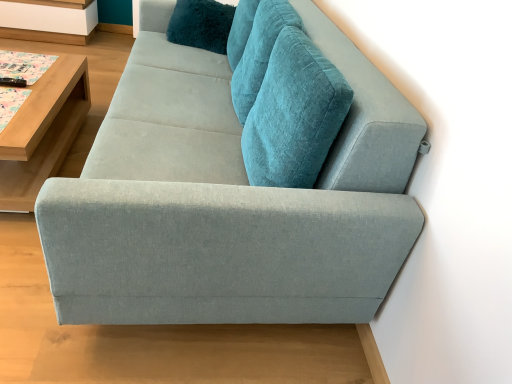
Question: From the image's perspective, is white wood shelf at upper left on teal plush pillow at upper center?

Choices:
 (A) yes
 (B) no

Answer: (A)

Question: From a real-world perspective, does white wood shelf at upper left stand above teal plush pillow at upper center?

Choices:
 (A) no
 (B) yes

Answer: (A)

Question: Is white wood shelf at upper left positioned far away from teal plush pillow at upper center?

Choices:
 (A) yes
 (B) no

Answer: (A)

Question: Does white wood shelf at upper left have a smaller size compared to teal plush pillow at upper center?

Choices:
 (A) yes
 (B) no

Answer: (B)

Question: Can you confirm if white wood shelf at upper left is bigger than teal plush pillow at upper center?

Choices:
 (A) yes
 (B) no

Answer: (A)

Question: In terms of height, does light wood/wooden table at left look taller or shorter compared to teal plush pillow at upper center?

Choices:
 (A) tall
 (B) short

Answer: (B)

Question: In the image, is light wood/wooden table at left positioned in front of or behind teal plush pillow at upper center?

Choices:
 (A) front
 (B) behind

Answer: (A)

Question: From the image's perspective, relative to teal plush pillow at upper center, is light wood/wooden table at left above or below?

Choices:
 (A) below
 (B) above

Answer: (A)

Question: Considering the positions of point (48, 109) and point (230, 16), is point (48, 109) closer or farther from the camera than point (230, 16)?

Choices:
 (A) farther
 (B) closer

Answer: (B)

Question: Relative to light gray fabric couch at center, is light wood/wooden table at left in front or behind?

Choices:
 (A) behind
 (B) front

Answer: (A)

Question: From the image's perspective, relative to light gray fabric couch at center, is light wood/wooden table at left above or below?

Choices:
 (A) above
 (B) below

Answer: (B)

Question: Considering the positions of light wood/wooden table at left and light gray fabric couch at center in the image, is light wood/wooden table at left wider or thinner than light gray fabric couch at center?

Choices:
 (A) thin
 (B) wide

Answer: (A)

Question: Is light wood/wooden table at left taller or shorter than light gray fabric couch at center?

Choices:
 (A) short
 (B) tall

Answer: (A)

Question: From their relative heights in the image, would you say white wood shelf at upper left is taller or shorter than light wood/wooden table at left?

Choices:
 (A) tall
 (B) short

Answer: (B)

Question: In the image, is white wood shelf at upper left on the left side or the right side of light wood/wooden table at left?

Choices:
 (A) left
 (B) right

Answer: (A)